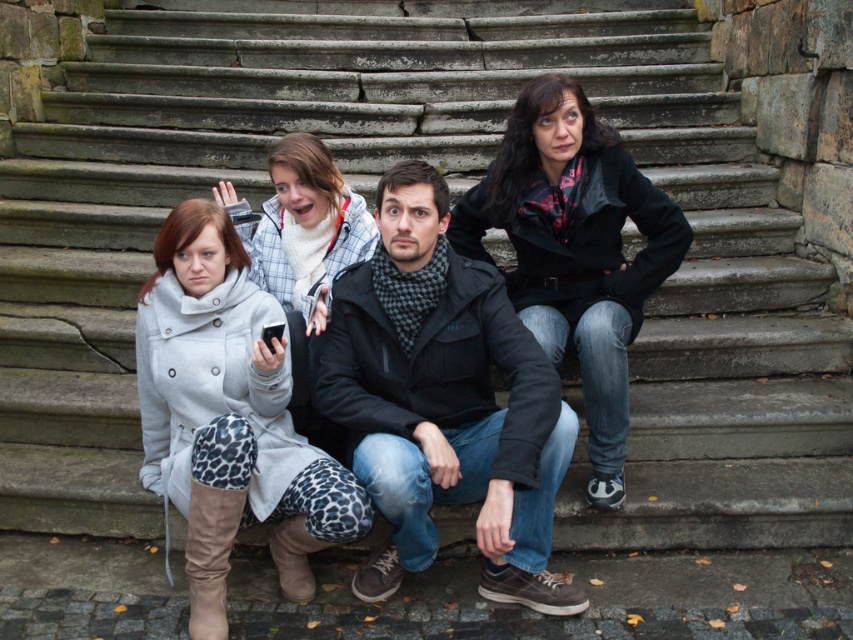
Question: Which is farther from the black leather jacket at center?

Choices:
 (A) light gray wool coat at center
 (B) white fleece jacket at center

Answer: (A)

Question: Which object appears closest to the camera in this image?

Choices:
 (A) dark gray matte jacket at center
 (B) white fleece jacket at center
 (C) light gray wool coat at center
 (D) black leather jacket at center

Answer: (A)

Question: Can you confirm if dark gray matte jacket at center is smaller than black leather jacket at center?

Choices:
 (A) no
 (B) yes

Answer: (A)

Question: Which of these objects is positioned farthest from the black leather jacket at center?

Choices:
 (A) dark gray matte jacket at center
 (B) white fleece jacket at center
 (C) light gray wool coat at center

Answer: (C)

Question: Is the position of dark gray matte jacket at center more distant than that of black leather jacket at center?

Choices:
 (A) no
 (B) yes

Answer: (A)

Question: Can you confirm if light gray wool coat at center is thinner than white fleece jacket at center?

Choices:
 (A) no
 (B) yes

Answer: (A)